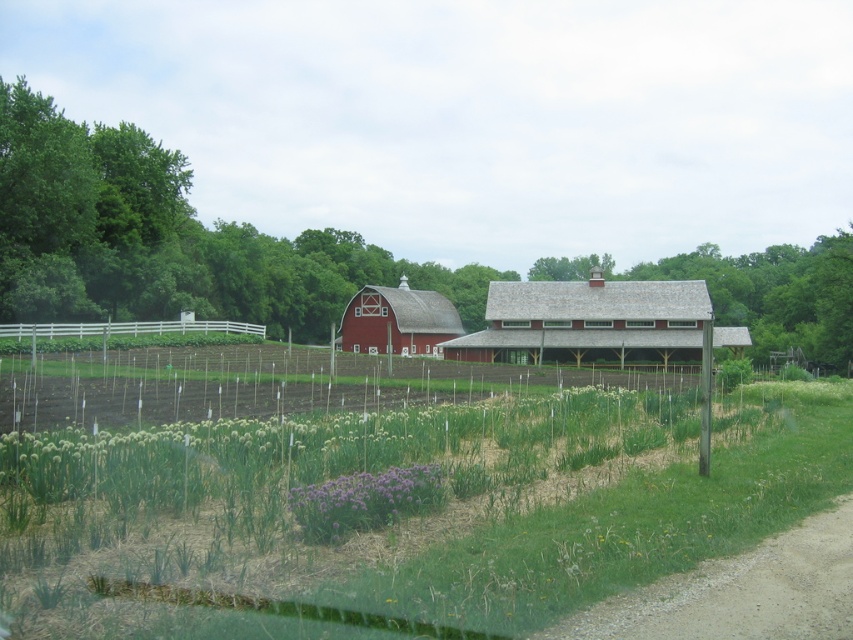
Question: Estimate the real-world distances between objects in this image. Which object is farther from the green grassy field at lower center?

Choices:
 (A) white wooden fence at left
 (B) matte red barn at center
 (C) purple matte flower at center

Answer: (B)

Question: Among these points, which one is farthest from the camera?

Choices:
 (A) (390, 513)
 (B) (704, 504)

Answer: (B)

Question: Is green grassy field at lower center positioned before white wooden fence at left?

Choices:
 (A) no
 (B) yes

Answer: (B)

Question: Is green grassy field at lower center thinner than matte red barn at center?

Choices:
 (A) no
 (B) yes

Answer: (A)

Question: Which point appears closest to the camera in this image?

Choices:
 (A) (125, 323)
 (B) (392, 291)
 (C) (305, 513)

Answer: (C)

Question: Observing the image, what is the correct spatial positioning of green grassy field at lower center in reference to white wooden fence at left?

Choices:
 (A) left
 (B) right

Answer: (B)